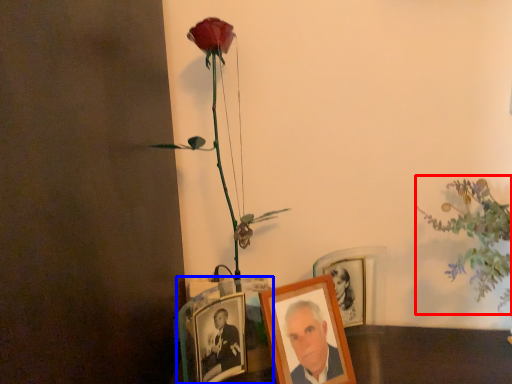
Question: Which object is closer to the camera taking this photo, floral arrangement (highlighted by a red box) or picture frame (highlighted by a blue box)?

Choices:
 (A) floral arrangement
 (B) picture frame

Answer: (A)